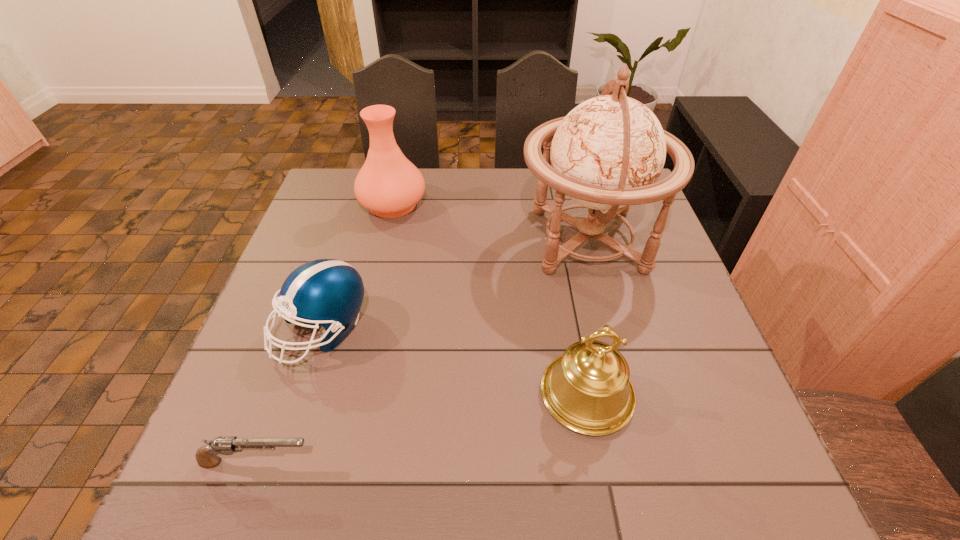
The height and width of the screenshot is (540, 960). What are the coordinates of `globe` in the screenshot? It's located at 607,153.

The width and height of the screenshot is (960, 540). I want to click on the fourth shortest object, so pyautogui.click(x=389, y=185).

Locate an element on the screen. The width and height of the screenshot is (960, 540). bell is located at coordinates (587, 389).

You are a GUI agent. You are given a task and a screenshot of the screen. Output one action in this format:
    pyautogui.click(x=<x>, y=<y>)
    Task: Click on the football helmet
    Image resolution: width=960 pixels, height=540 pixels.
    Given the screenshot: What is the action you would take?
    pyautogui.click(x=328, y=292)

Where is `the shortest object`? The image size is (960, 540). the shortest object is located at coordinates (206, 456).

Find the location of a particular element. the nearest object is located at coordinates (206, 456).

The width and height of the screenshot is (960, 540). Identify the location of free spot located at the front of the tallest object showing Africa. (x=408, y=240).

This screenshot has width=960, height=540. In order to click on vacant space located 0.270m at the front of the tallest object showing Africa in this screenshot , I will do `click(420, 240)`.

Identify the location of vacant area situated 0.150m at the front of the tallest object showing Africa. The height and width of the screenshot is (540, 960). (463, 240).

Locate an element on the screen. The image size is (960, 540). vacant space positioned on the right of the second tallest object is located at coordinates (479, 204).